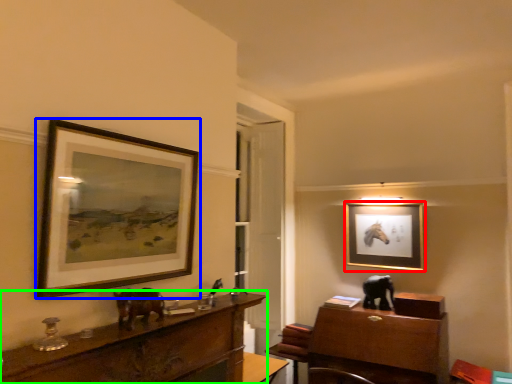
Question: Considering the real-world distances, which object is closest to picture frame (highlighted by a red box)? picture frame (highlighted by a blue box) or desk (highlighted by a green box).

Choices:
 (A) picture frame
 (B) desk

Answer: (B)